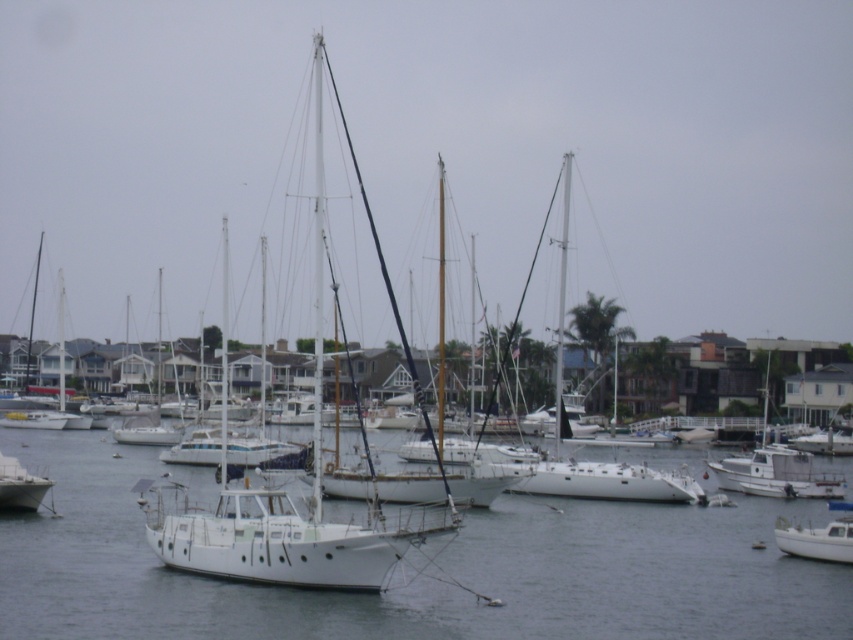
Question: Among these points, which one is farthest from the camera?

Choices:
 (A) (811, 529)
 (B) (830, 477)

Answer: (B)

Question: Estimate the real-world distances between objects in this image. Which object is farther from the white matte boat at lower right?

Choices:
 (A) white matte boat at center
 (B) white matte water at center

Answer: (A)

Question: Considering the relative positions of white matte water at center and white matte boat at center in the image provided, where is white matte water at center located with respect to white matte boat at center?

Choices:
 (A) below
 (B) above

Answer: (A)

Question: Considering the relative positions of white matte boat at center and white matte sailboat at lower left in the image provided, where is white matte boat at center located with respect to white matte sailboat at lower left?

Choices:
 (A) left
 (B) right

Answer: (B)

Question: Among these points, which one is farthest from the camera?

Choices:
 (A) (727, 596)
 (B) (13, 467)
 (C) (775, 476)

Answer: (C)

Question: Does white matte boat at center come behind white matte boat at lower right?

Choices:
 (A) no
 (B) yes

Answer: (B)